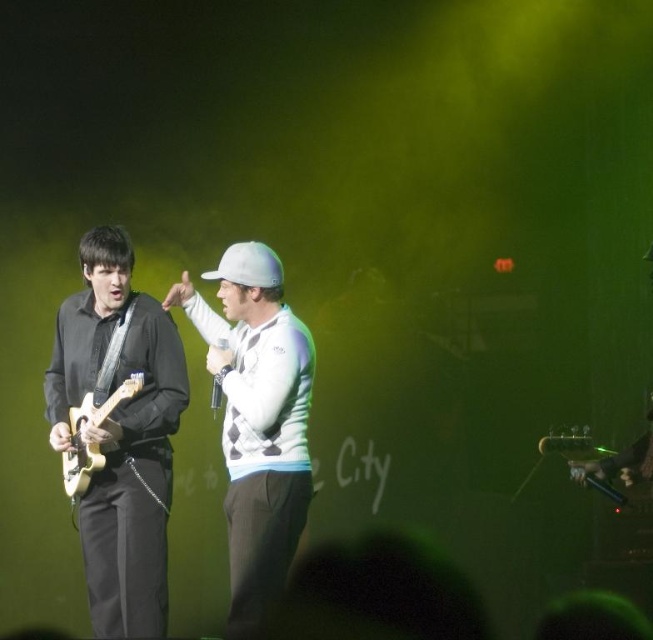
You are a photographer at the back of the stage. You want to capture a closeup of the white textured sweater at center. Which performer should you focus on?

The white textured sweater at center is worn by the individual on the right, so you should focus on them to capture the closeup.

You are a photographer setting up for a concert photo shoot. You need to ensure that the white textured sweater at center and the light wood electric guitar at left are both in frame. Given that the camera has a fixed focal length, which object should you prioritize positioning closer to the camera to ensure both fit within the frame?

The white textured sweater at center is wider than the light wood electric guitar at left. To ensure both fit within the frame, prioritize positioning the white textured sweater at center closer to the camera since its greater width requires more space in the frame.

You are a stagehand setting up microphones for the performers. You need to place a microphone stand to the left of both guitars. Which guitar should you place the stand closer to, the matte black guitar at left or the light wood electric guitar at left?

The matte black guitar at left is positioned on the right side of light wood electric guitar at left, so to place the microphone stand to the left of both guitars, it should be closer to the light wood electric guitar at left.